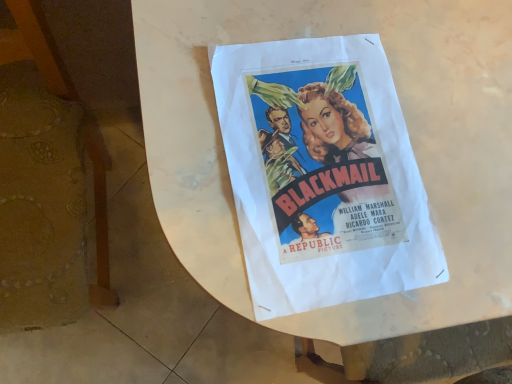
Question: From the image's perspective, does matte paper poster at center appear lower than wooden chair at left?

Choices:
 (A) yes
 (B) no

Answer: (B)

Question: Is matte paper poster at center bigger than wooden chair at left?

Choices:
 (A) yes
 (B) no

Answer: (B)

Question: Could you tell me if matte paper poster at center is turned towards wooden chair at left?

Choices:
 (A) no
 (B) yes

Answer: (A)

Question: Does matte paper poster at center have a lesser width compared to wooden chair at left?

Choices:
 (A) no
 (B) yes

Answer: (B)

Question: Is matte paper poster at center smaller than wooden chair at left?

Choices:
 (A) no
 (B) yes

Answer: (B)

Question: Based on their positions, is wooden chair at left located to the left or right of matte paper poster at center?

Choices:
 (A) left
 (B) right

Answer: (A)

Question: From a real-world perspective, relative to matte paper poster at center, is wooden chair at left vertically above or below?

Choices:
 (A) below
 (B) above

Answer: (A)

Question: Is point (70, 210) closer or farther from the camera than point (336, 276)?

Choices:
 (A) closer
 (B) farther

Answer: (B)

Question: From the image's perspective, is wooden chair at left located above or below matte paper poster at center?

Choices:
 (A) below
 (B) above

Answer: (A)

Question: From a real-world perspective, relative to wooden chair at left, is matte paper poster at center vertically above or below?

Choices:
 (A) below
 (B) above

Answer: (B)

Question: In the image, is matte paper poster at center positioned in front of or behind wooden chair at left?

Choices:
 (A) front
 (B) behind

Answer: (B)

Question: Considering the positions of matte paper poster at center and wooden chair at left in the image, is matte paper poster at center wider or thinner than wooden chair at left?

Choices:
 (A) wide
 (B) thin

Answer: (B)

Question: Considering the positions of point (253, 84) and point (31, 152), is point (253, 84) closer or farther from the camera than point (31, 152)?

Choices:
 (A) closer
 (B) farther

Answer: (A)

Question: Is matte paper poster at center inside the boundaries of white paper at center, or outside?

Choices:
 (A) outside
 (B) inside

Answer: (B)

Question: Is matte paper poster at center taller or shorter than white paper at center?

Choices:
 (A) short
 (B) tall

Answer: (A)